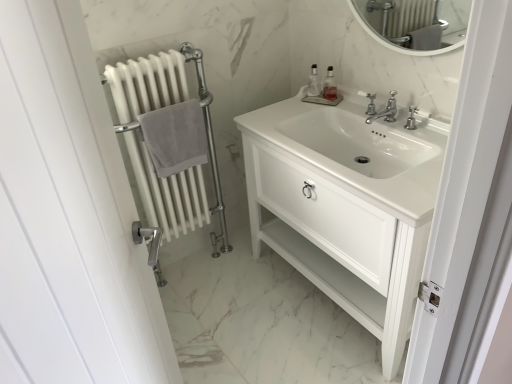
This screenshot has height=384, width=512. Find the location of `vacant point above white matte radiator at left (from a real-world perspective)`. vacant point above white matte radiator at left (from a real-world perspective) is located at coordinates (139, 60).